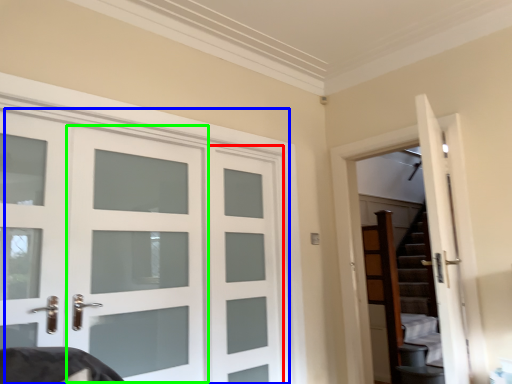
Question: Based on their relative distances, which object is nearer to screen door (highlighted by a red box)? Choose from door (highlighted by a blue box) and screen door (highlighted by a green box).

Choices:
 (A) door
 (B) screen door

Answer: (A)